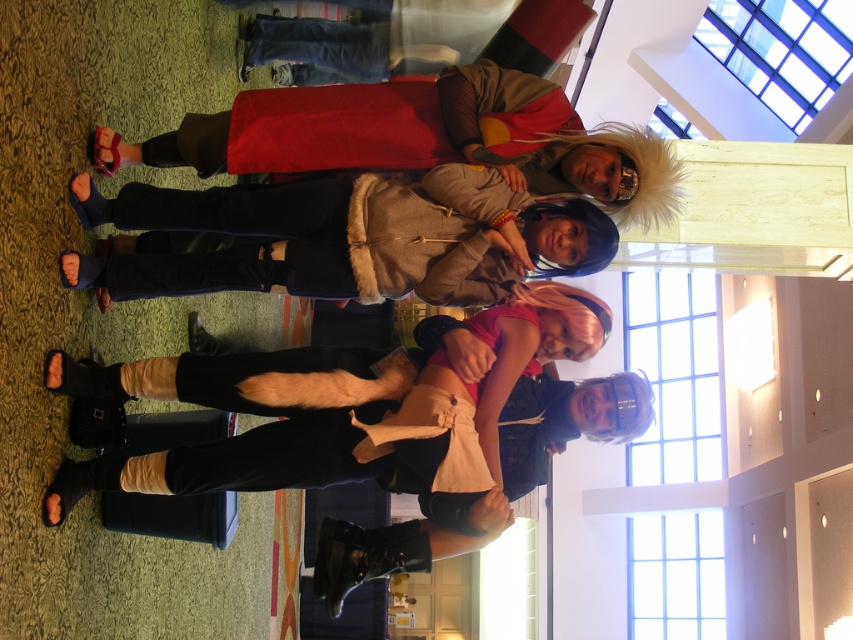
Question: Is velvet-like red cape at upper center positioned behind fur-lined jacket at center?

Choices:
 (A) yes
 (B) no

Answer: (A)

Question: Can you confirm if velvet-like red cape at upper center is thinner than fur-lined jacket at center?

Choices:
 (A) no
 (B) yes

Answer: (A)

Question: Is the position of velvet-like red cape at upper center more distant than that of fur-lined jacket at center?

Choices:
 (A) yes
 (B) no

Answer: (A)

Question: Which of the following is the closest to the observer?

Choices:
 (A) (251, 145)
 (B) (585, 260)

Answer: (B)